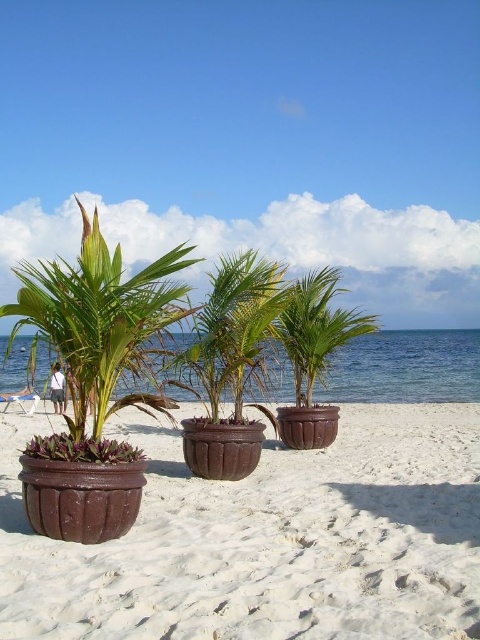
You are setting up a garden display on the beach and have two pots, the matte brown pot at left and the brown textured pot at center. Which pot should you choose if you want the larger one for a bigger plant?

The brown textured pot at center is larger than the matte brown pot at left, so you should choose the brown textured pot at center for the bigger plant.

You are a beachcomber searching for a place to set up your umbrella. You have a large umbrella that requires a wide base for stability. You see the brown textured sand at center and the matte brown pot at left. Which location would provide a more stable base for your umbrella?

The brown textured sand at center has a larger width than the matte brown pot at left, so it would provide a more stable base for your umbrella.